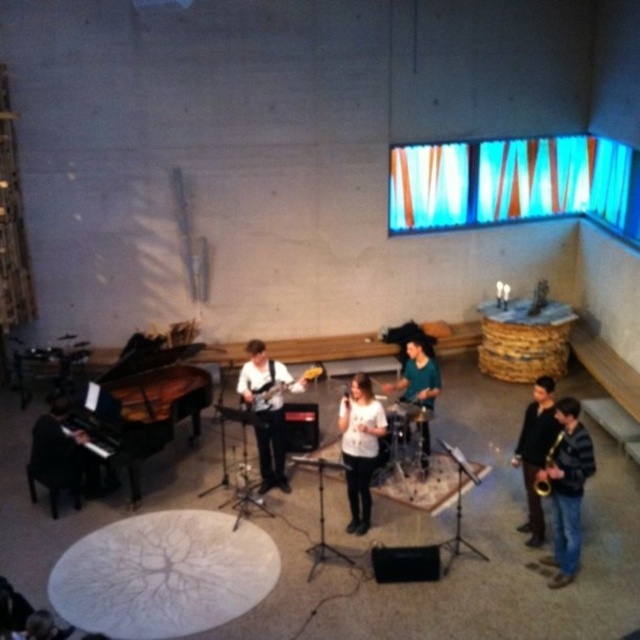
Consider the image. You are a stagehand setting up equipment in the performance space. You need to place a new speaker system between the black polished piano at left and the black piano at left. Which piano should the speaker system be placed closer to if you want it to be closer to the taller object?

The black polished piano at left is much taller than the black piano at left, so the speaker system should be placed closer to the black polished piano at left to be near the taller object.

You are a photographer in the room and want to capture a photo where both the teal fabric shirt at center and the matte black electric guitar at center are visible. Based on their positions, which one should you focus on first to ensure both are in frame?

The teal fabric shirt at center is below the matte black electric guitar at center, so you should focus on the matte black electric guitar at center first to ensure both are in frame.

You are a stagehand setting up a new speaker system in the performance space. You need to place a speaker between the black polished piano at left and the black piano at left. Since both are pianos, can you confirm which one is wider to determine where to position the speaker?

The black polished piano at left is wider than the black piano at left, so you should place the speaker closer to the black polished piano at left to ensure adequate space.